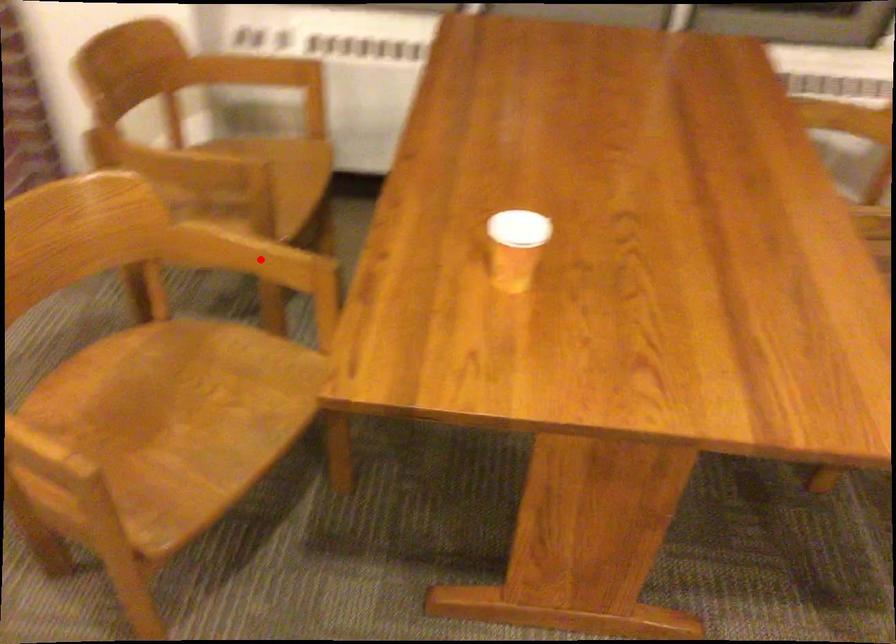
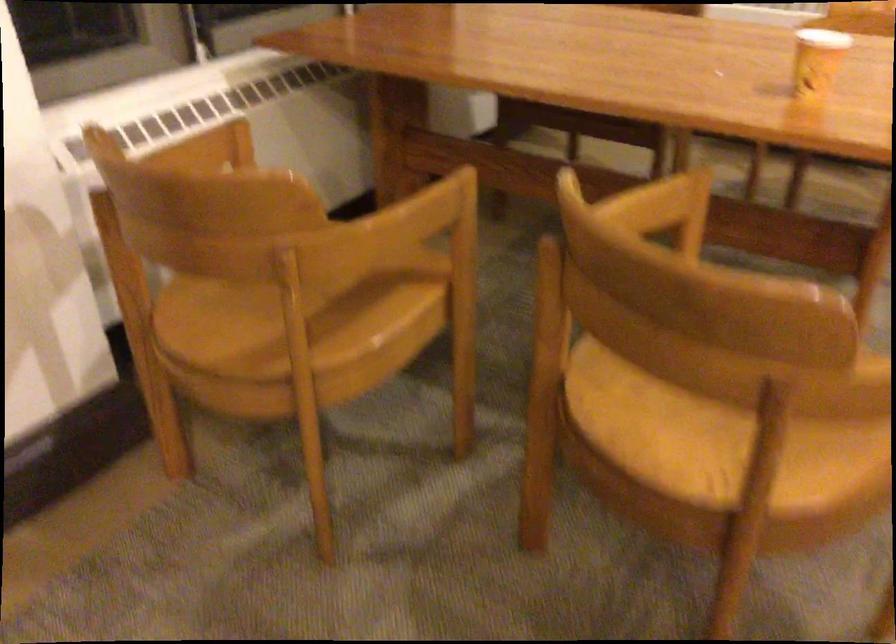
Where in the second image is the point corresponding to the highlighted location from the first image?

(650, 205)